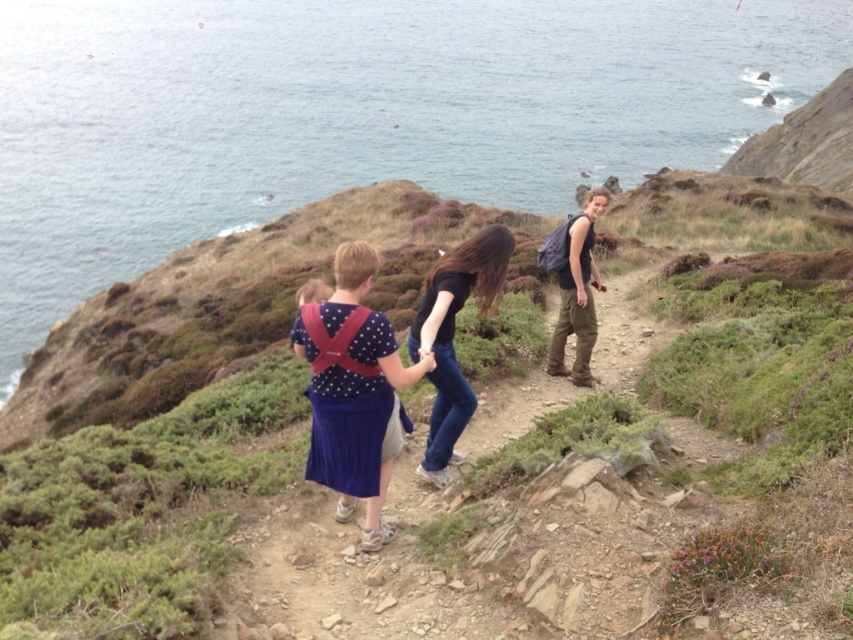
You are a hiker trying to locate the person wearing the matte blue dress at center on the rugged coastal path. According to the coordinates provided, where exactly would you find this individual in relation to the group?

The matte blue dress at center is located at point (337, 572), which places it centrally within the group, likely near the middle of the hiking path.

You are a hiker trying to navigate the rugged coastal path. You see two points marked on the terrain. The first point is at coordinate point [252,74] and the second is at point [329,337]. Which point is closer to you as you stand on the path?

Point [252,74] is closer to you because it is further to the viewer than point [329,337].